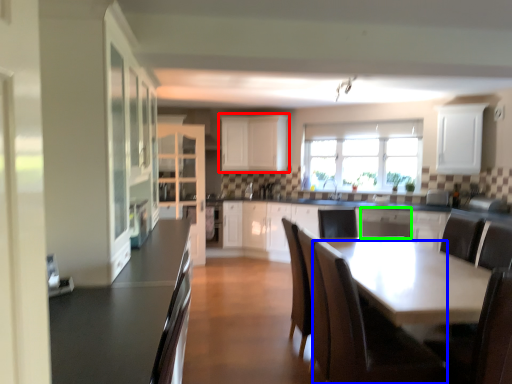
Question: Estimate the real-world distances between objects in this image. Which object is farther from cabinetry (highlighted by a red box), chair (highlighted by a blue box) or dish washer (highlighted by a green box)?

Choices:
 (A) chair
 (B) dish washer

Answer: (A)